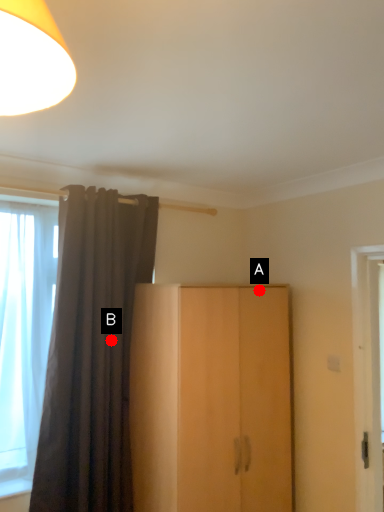
Question: Two points are circled on the image, labeled by A and B beside each circle. Which point appears farthest from the camera in this image?

Choices:
 (A) A is further
 (B) B is further

Answer: (A)